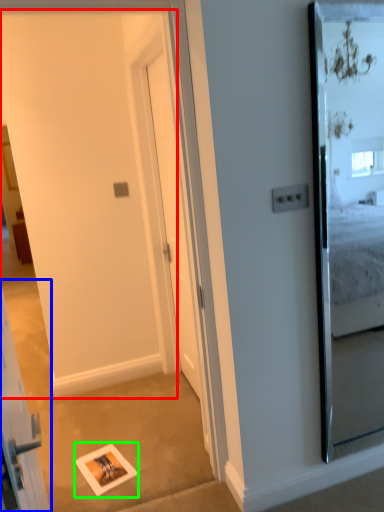
Question: Considering the real-world distances, which object is farthest from barn door (highlighted by a red box)? elevator (highlighted by a blue box) or picture frame (highlighted by a green box)?

Choices:
 (A) elevator
 (B) picture frame

Answer: (A)